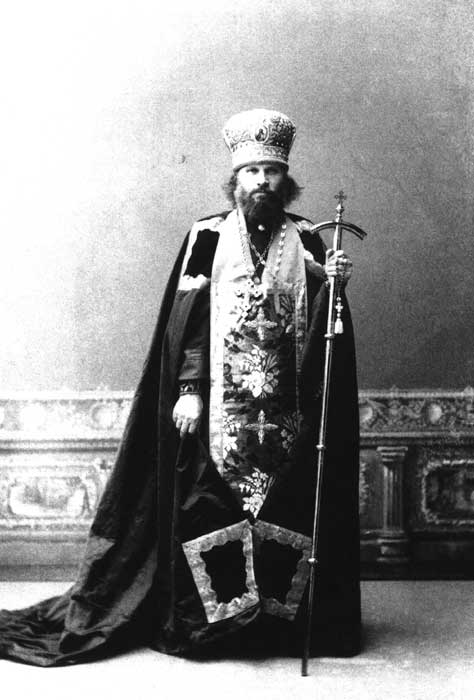
I want to click on handle, so click(343, 225).